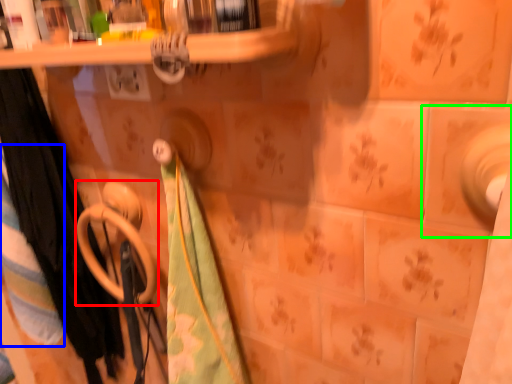
Question: Which is farther away from towel rack (highlighted by a red box)? beach towel (highlighted by a blue box) or ceramic tile (highlighted by a green box)?

Choices:
 (A) beach towel
 (B) ceramic tile

Answer: (B)